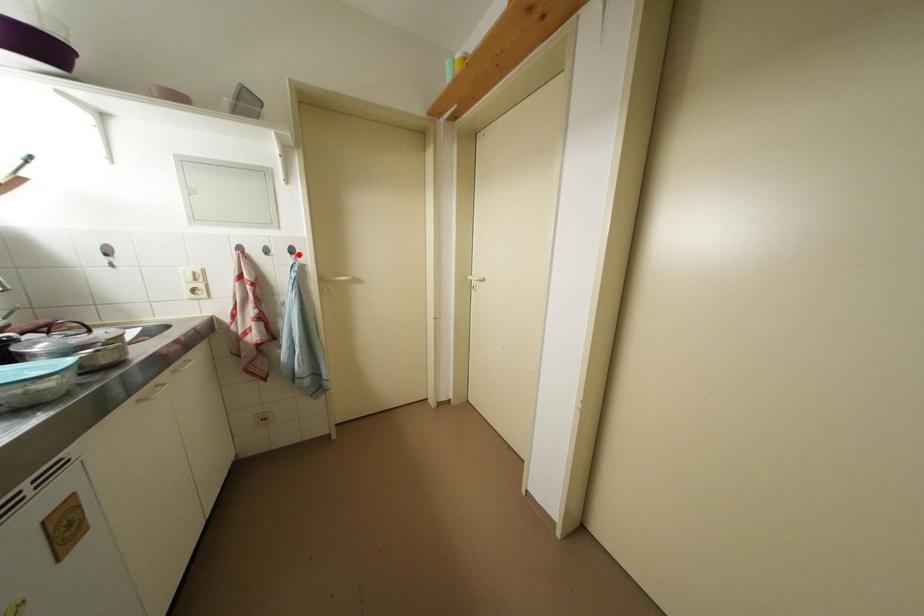
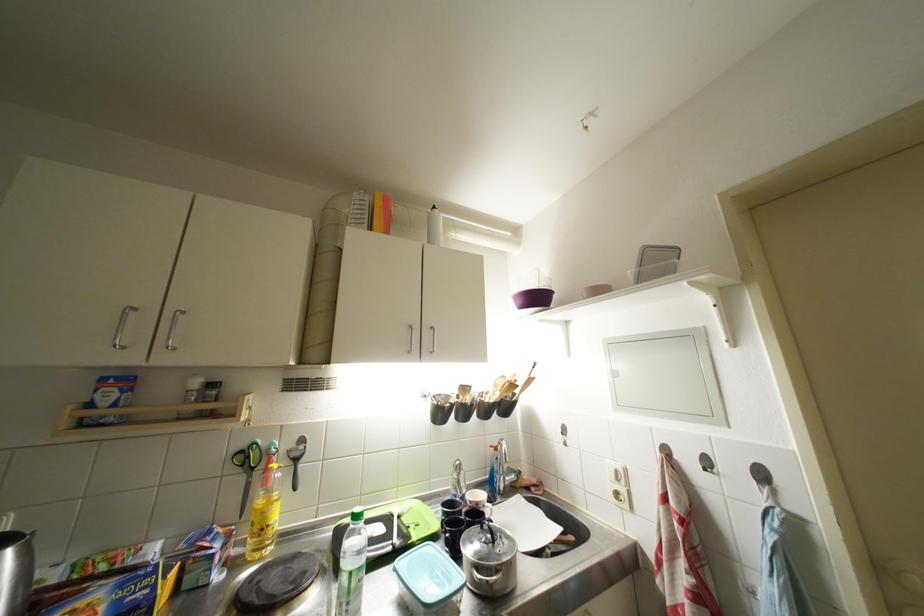
Find the pixel in the second image that matches the highlighted location in the first image.

(769, 479)